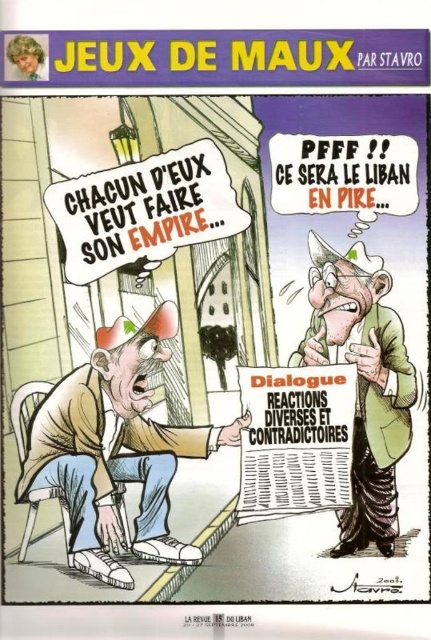
Question: Does brown leather jacket at lower left appear under golden hair wig at upper left?

Choices:
 (A) no
 (B) yes

Answer: (B)

Question: Which point is closer to the camera?

Choices:
 (A) green felt hat at upper center
 (B) brown leather jacket at lower left
 (C) white paper newspaper at center
 (D) white canvas shoes at lower center

Answer: (B)

Question: Is brown leather jacket at lower left thinner than white canvas shoes at lower center?

Choices:
 (A) no
 (B) yes

Answer: (A)

Question: Which object is the farthest from the golden hair wig at upper left?

Choices:
 (A) white canvas shoes at lower center
 (B) green felt hat at upper center
 (C) brown leather jacket at lower left
 (D) white paper newspaper at center

Answer: (A)

Question: Which object is the closest to the golden hair wig at upper left?

Choices:
 (A) white paper newspaper at center
 (B) green felt hat at upper center
 (C) white canvas shoes at lower center

Answer: (B)

Question: Does brown leather jacket at lower left appear over green felt hat at upper center?

Choices:
 (A) no
 (B) yes

Answer: (A)